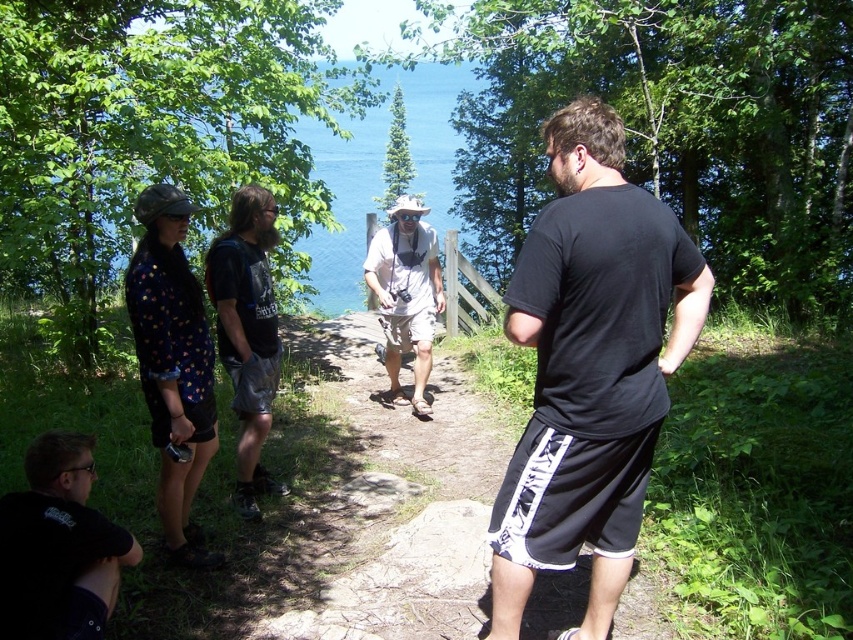
Question: Which point appears closest to the camera in this image?

Choices:
 (A) (373, 291)
 (B) (445, 426)
 (C) (90, 620)

Answer: (C)

Question: Can you confirm if black matte t-shirt at lower left is bigger than white cotton shirt at center?

Choices:
 (A) no
 (B) yes

Answer: (A)

Question: Which object is closer to the camera taking this photo?

Choices:
 (A) black fabric shorts at center
 (B) white cotton shirt at center
 (C) dark blue t-shirt at center
 (D) black matte t-shirt at lower left

Answer: (D)

Question: Can you confirm if black fabric shorts at center is thinner than dark blue t-shirt at center?

Choices:
 (A) no
 (B) yes

Answer: (A)

Question: Estimate the real-world distances between objects in this image. Which object is closer to the white cotton shirt at center?

Choices:
 (A) black fabric shorts at center
 (B) black matte t-shirt at lower left
 (C) black cotton t-shirt at center
 (D) dark blue t-shirt at center

Answer: (A)

Question: Where is black cotton t-shirt at center located in relation to dark blue t-shirt at center in the image?

Choices:
 (A) left
 (B) right

Answer: (B)